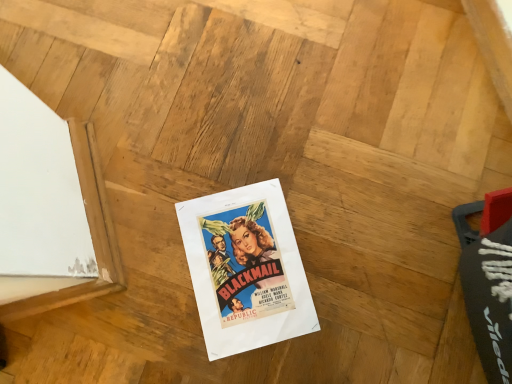
The width and height of the screenshot is (512, 384). What are the coordinates of `free spot below matte paper poster at center (from a real-world perspective)` in the screenshot? It's located at (244, 270).